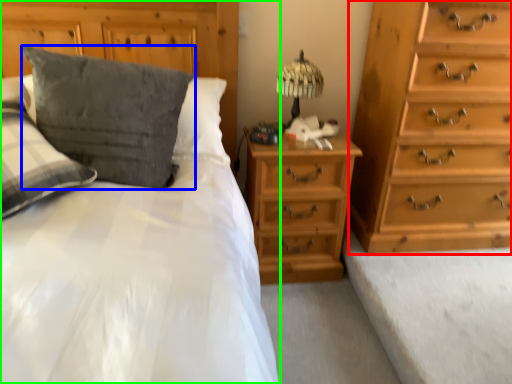
Question: Estimate the real-world distances between objects in this image. Which object is closer to chest of drawers (highlighted by a red box), pillow (highlighted by a blue box) or bed (highlighted by a green box)?

Choices:
 (A) pillow
 (B) bed

Answer: (B)